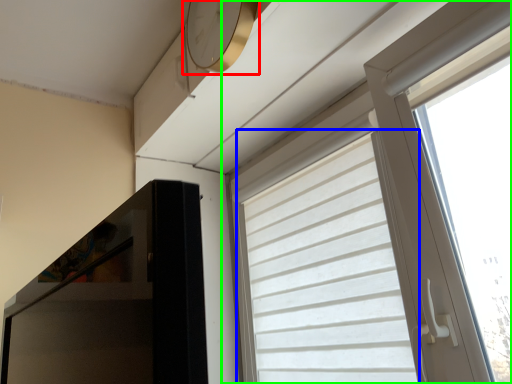
Question: Based on their relative distances, which object is farther from clock (highlighted by a red box)? Choose from curtain (highlighted by a blue box) and window (highlighted by a green box).

Choices:
 (A) curtain
 (B) window

Answer: (A)